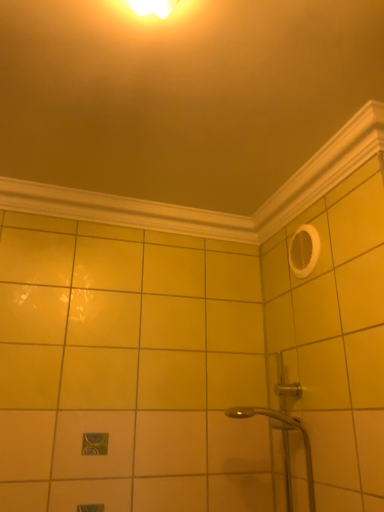
Describe the element at coordinates (212, 211) in the screenshot. This screenshot has width=384, height=512. I see `white glossy molding at upper center, the second molding ordered from the bottom` at that location.

In order to face white glossy molding at upper center, the second molding ordered from the bottom, should I rotate leftwards or rightwards?

Rotate your view left by about 0.492°.

Locate an element on the screen. The height and width of the screenshot is (512, 384). white glossy molding at upper center, the first molding in the top-to-bottom sequence is located at coordinates (212, 211).

What is the approximate height of white glossy molding at upper center, the second molding ordered from the bottom?

white glossy molding at upper center, the second molding ordered from the bottom, is 2.80 inches tall.

The width and height of the screenshot is (384, 512). Describe the element at coordinates (124, 211) in the screenshot. I see `white wood molding at upper center, the 2th molding viewed from the top` at that location.

You are a GUI agent. You are given a task and a screenshot of the screen. Output one action in this format:
    pyautogui.click(x=<x>, y=<y>)
    Task: Click on the white wood molding at upper center, which appears as the 1th molding when ordered from the bottom
    The image size is (384, 512).
    Given the screenshot: What is the action you would take?
    pyautogui.click(x=124, y=211)

Find the location of a particular element. The image size is (384, 512). white glossy molding at upper center, the first molding in the top-to-bottom sequence is located at coordinates (212, 211).

Between white wood molding at upper center, which appears as the 1th molding when ordered from the bottom, and white glossy molding at upper center, the first molding in the top-to-bottom sequence, which one appears on the right side from the viewer's perspective?

white glossy molding at upper center, the first molding in the top-to-bottom sequence.

Considering their positions, is white wood molding at upper center, which appears as the 1th molding when ordered from the bottom, located in front of or behind white glossy molding at upper center, the second molding ordered from the bottom?

Clearly, white wood molding at upper center, which appears as the 1th molding when ordered from the bottom, is behind white glossy molding at upper center, the second molding ordered from the bottom.

Is point (104, 221) positioned in front of point (24, 186)?

No.

From the image's perspective, between white wood molding at upper center, which appears as the 1th molding when ordered from the bottom, and white glossy molding at upper center, the first molding in the top-to-bottom sequence, who is located below?

white wood molding at upper center, which appears as the 1th molding when ordered from the bottom, is shown below in the image.

From a real-world perspective, is white wood molding at upper center, which appears as the 1th molding when ordered from the bottom, physically above white glossy molding at upper center, the first molding in the top-to-bottom sequence?

No, from a real-world perspective, white wood molding at upper center, which appears as the 1th molding when ordered from the bottom, is not above white glossy molding at upper center, the first molding in the top-to-bottom sequence.

Which of these two, white wood molding at upper center, which appears as the 1th molding when ordered from the bottom, or white glossy molding at upper center, the first molding in the top-to-bottom sequence, is wider?

With larger width is white glossy molding at upper center, the first molding in the top-to-bottom sequence.

Considering the relative sizes of white wood molding at upper center, which appears as the 1th molding when ordered from the bottom, and white glossy molding at upper center, the first molding in the top-to-bottom sequence, in the image provided, is white wood molding at upper center, which appears as the 1th molding when ordered from the bottom, shorter than white glossy molding at upper center, the first molding in the top-to-bottom sequence,?

No, white wood molding at upper center, which appears as the 1th molding when ordered from the bottom, is not shorter than white glossy molding at upper center, the first molding in the top-to-bottom sequence.

Who is smaller, white wood molding at upper center, which appears as the 1th molding when ordered from the bottom, or white glossy molding at upper center, the second molding ordered from the bottom?

white wood molding at upper center, which appears as the 1th molding when ordered from the bottom.

Is white glossy molding at upper center, the first molding in the top-to-bottom sequence, inside white wood molding at upper center, which appears as the 1th molding when ordered from the bottom?

No, white wood molding at upper center, which appears as the 1th molding when ordered from the bottom, does not contain white glossy molding at upper center, the first molding in the top-to-bottom sequence.

Is white wood molding at upper center, which appears as the 1th molding when ordered from the bottom, far from white glossy molding at upper center, the second molding ordered from the bottom?

No, white wood molding at upper center, which appears as the 1th molding when ordered from the bottom, is not far from white glossy molding at upper center, the second molding ordered from the bottom.

Does white wood molding at upper center, which appears as the 1th molding when ordered from the bottom, turn towards white glossy molding at upper center, the second molding ordered from the bottom?

Yes, white wood molding at upper center, which appears as the 1th molding when ordered from the bottom, faces towards white glossy molding at upper center, the second molding ordered from the bottom.

How far apart are white wood molding at upper center, which appears as the 1th molding when ordered from the bottom, and white glossy molding at upper center, the second molding ordered from the bottom?

white wood molding at upper center, which appears as the 1th molding when ordered from the bottom, and white glossy molding at upper center, the second molding ordered from the bottom, are 3.48 inches apart from each other.

The width and height of the screenshot is (384, 512). I want to click on molding in front of the white wood molding at upper center, the 2th molding viewed from the top, so click(212, 211).

Is white glossy molding at upper center, the first molding in the top-to-bottom sequence, at the left side of white wood molding at upper center, which appears as the 1th molding when ordered from the bottom?

Incorrect, white glossy molding at upper center, the first molding in the top-to-bottom sequence, is not on the left side of white wood molding at upper center, which appears as the 1th molding when ordered from the bottom.

Considering the relative positions of white glossy molding at upper center, the second molding ordered from the bottom, and white wood molding at upper center, the 2th molding viewed from the top, in the image provided, is white glossy molding at upper center, the second molding ordered from the bottom, behind white wood molding at upper center, the 2th molding viewed from the top,?

No.

Does point (48, 202) lie behind point (149, 209)?

No.

From the image's perspective, is white glossy molding at upper center, the second molding ordered from the bottom, on white wood molding at upper center, which appears as the 1th molding when ordered from the bottom?

Indeed, from the image's perspective, white glossy molding at upper center, the second molding ordered from the bottom, is shown above white wood molding at upper center, which appears as the 1th molding when ordered from the bottom.

From a real-world perspective, relative to white wood molding at upper center, the 2th molding viewed from the top, is white glossy molding at upper center, the first molding in the top-to-bottom sequence, vertically above or below?

Clearly, from a real-world perspective, white glossy molding at upper center, the first molding in the top-to-bottom sequence, is above white wood molding at upper center, the 2th molding viewed from the top.

In the scene shown: Between white glossy molding at upper center, the second molding ordered from the bottom, and white wood molding at upper center, which appears as the 1th molding when ordered from the bottom, which one has larger width?

white glossy molding at upper center, the second molding ordered from the bottom, is wider.

Does white glossy molding at upper center, the second molding ordered from the bottom, have a lesser height compared to white wood molding at upper center, which appears as the 1th molding when ordered from the bottom?

Yes.

Is white glossy molding at upper center, the first molding in the top-to-bottom sequence, bigger than white wood molding at upper center, the 2th molding viewed from the top?

Correct, white glossy molding at upper center, the first molding in the top-to-bottom sequence, is larger in size than white wood molding at upper center, the 2th molding viewed from the top.

Which is correct: white glossy molding at upper center, the second molding ordered from the bottom, is inside white wood molding at upper center, which appears as the 1th molding when ordered from the bottom, or outside of it?

white glossy molding at upper center, the second molding ordered from the bottom, lies outside white wood molding at upper center, which appears as the 1th molding when ordered from the bottom.

In the scene shown: Is white glossy molding at upper center, the second molding ordered from the bottom, beside white wood molding at upper center, the 2th molding viewed from the top?

Yes, white glossy molding at upper center, the second molding ordered from the bottom, is touching white wood molding at upper center, the 2th molding viewed from the top.

Could you tell me if white glossy molding at upper center, the first molding in the top-to-bottom sequence, is turned towards white wood molding at upper center, the 2th molding viewed from the top?

No, white glossy molding at upper center, the first molding in the top-to-bottom sequence, is not aimed at white wood molding at upper center, the 2th molding viewed from the top.

At what (x,y) coordinates should I click in order to perform the action: click on molding that is above the white wood molding at upper center, which appears as the 1th molding when ordered from the bottom (from the image's perspective). Please return your answer as a coordinate pair (x, y). The width and height of the screenshot is (384, 512). Looking at the image, I should click on (212, 211).

In the image, there is a white glossy molding at upper center, the second molding ordered from the bottom. At what (x,y) coordinates should I click in order to perform the action: click on molding below it (from a real-world perspective). Please return your answer as a coordinate pair (x, y). The height and width of the screenshot is (512, 384). Looking at the image, I should click on (124, 211).

Locate an element on the screen. This screenshot has width=384, height=512. molding behind the white glossy molding at upper center, the second molding ordered from the bottom is located at coordinates (124, 211).